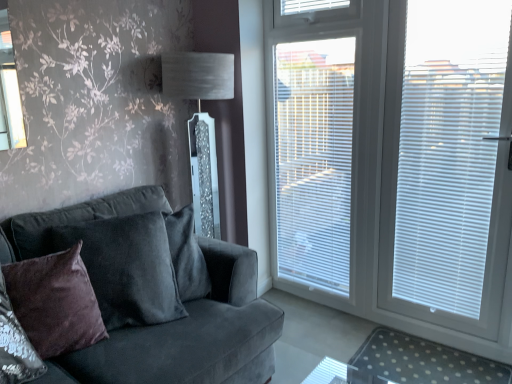
Question: From the image's perspective, is clear polka dot mat at lower right above white plastic blinds at right, positioned as the 1th blind in right-to-left order?

Choices:
 (A) yes
 (B) no

Answer: (B)

Question: Considering the relative sizes of clear polka dot mat at lower right and white plastic blinds at right, positioned as the 1th blind in right-to-left order, in the image provided, is clear polka dot mat at lower right smaller than white plastic blinds at right, positioned as the 1th blind in right-to-left order,?

Choices:
 (A) no
 (B) yes

Answer: (B)

Question: Can white plastic blinds at right, positioned as the 1th blind in right-to-left order, be found inside clear polka dot mat at lower right?

Choices:
 (A) yes
 (B) no

Answer: (B)

Question: Is clear polka dot mat at lower right taller than white plastic blinds at right, positioned as the third blind in left-to-right order?

Choices:
 (A) yes
 (B) no

Answer: (B)

Question: From the image's perspective, is clear polka dot mat at lower right under white plastic blinds at right, positioned as the third blind in left-to-right order?

Choices:
 (A) no
 (B) yes

Answer: (B)

Question: Is white plastic blinds at upper center, which ranks as the first blind in left-to-right order, bigger or smaller than white plastic blinds at right, which is counted as the second blind, starting from the right?

Choices:
 (A) small
 (B) big

Answer: (A)

Question: From the image's perspective, is white plastic blinds at upper center, acting as the third blind starting from the right, above or below white plastic blinds at right, which is counted as the second blind, starting from the right?

Choices:
 (A) above
 (B) below

Answer: (A)

Question: Is white plastic blinds at upper center, acting as the third blind starting from the right, wider or thinner than white plastic blinds at right, which is counted as the second blind, starting from the right?

Choices:
 (A) wide
 (B) thin

Answer: (B)

Question: Considering the positions of point (320, 8) and point (313, 74), is point (320, 8) closer or farther from the camera than point (313, 74)?

Choices:
 (A) closer
 (B) farther

Answer: (A)

Question: Is point (10, 269) closer or farther from the camera than point (449, 200)?

Choices:
 (A) farther
 (B) closer

Answer: (B)

Question: Relative to white plastic blinds at right, positioned as the third blind in left-to-right order, is velvet brown pillow at left in front or behind?

Choices:
 (A) front
 (B) behind

Answer: (A)

Question: Which is correct: velvet brown pillow at left is inside white plastic blinds at right, positioned as the 1th blind in right-to-left order, or outside of it?

Choices:
 (A) inside
 (B) outside

Answer: (B)

Question: From the image's perspective, is velvet brown pillow at left located above or below white plastic blinds at right, positioned as the 1th blind in right-to-left order?

Choices:
 (A) below
 (B) above

Answer: (A)

Question: In the image, is white plastic blinds at right, positioned as the third blind in left-to-right order, on the left side or the right side of velvet dark gray couch at left?

Choices:
 (A) left
 (B) right

Answer: (B)

Question: Considering their positions, is white plastic blinds at right, positioned as the third blind in left-to-right order, located in front of or behind velvet dark gray couch at left?

Choices:
 (A) front
 (B) behind

Answer: (B)